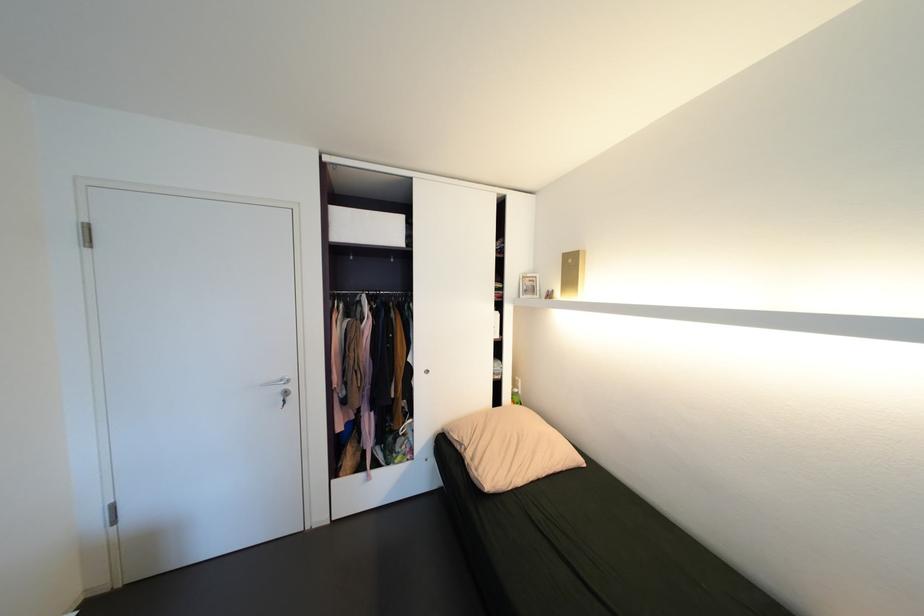
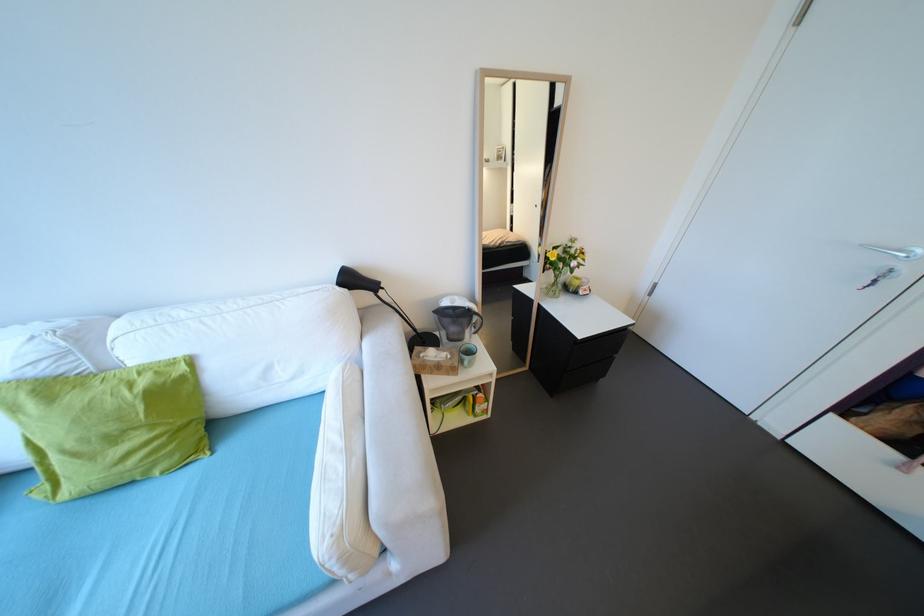
First-person continuous shooting, in which direction is the camera rotating?

The camera's rotation is toward left-down.